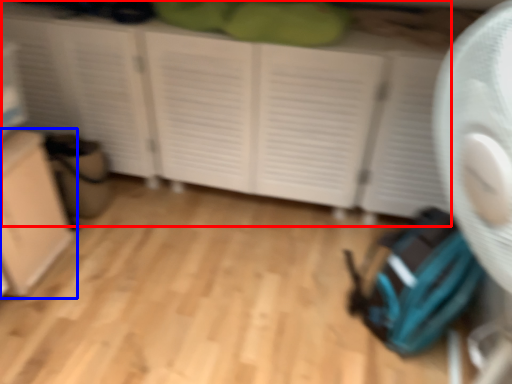
Question: Which object is further to the camera taking this photo, cupboard (highlighted by a red box) or cabinetry (highlighted by a blue box)?

Choices:
 (A) cupboard
 (B) cabinetry

Answer: (A)